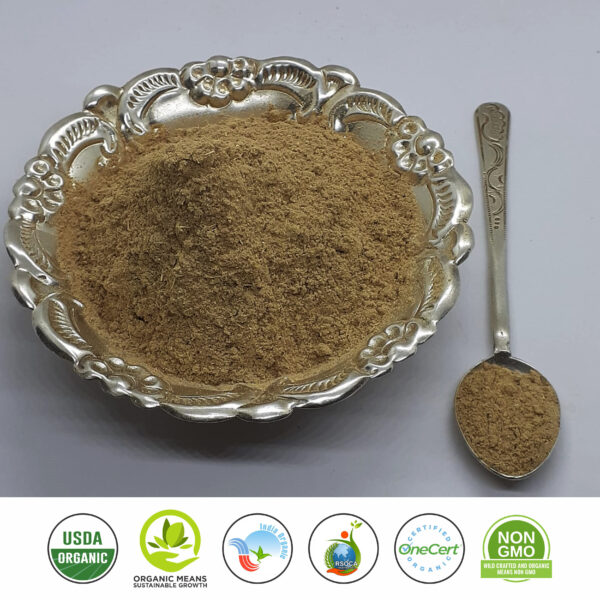
The height and width of the screenshot is (600, 600). Identify the location of spoon. click(508, 331).